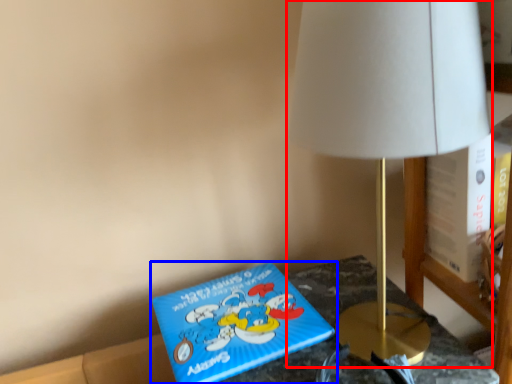
Question: Which of the following is the farthest to the observer, lamp (highlighted by a red box) or book (highlighted by a blue box)?

Choices:
 (A) lamp
 (B) book

Answer: (B)